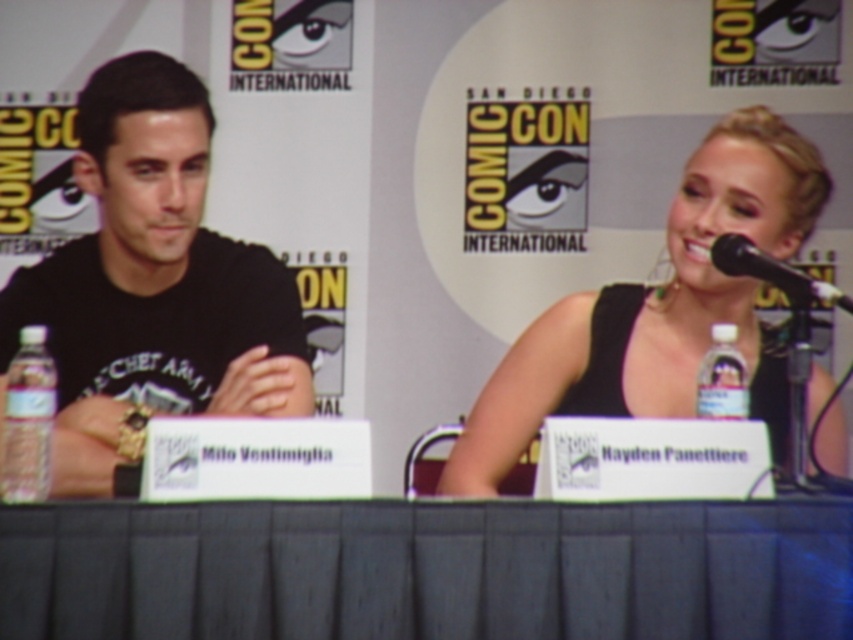
Is black fabric table at center wider than clear plastic bottle at center?

Correct, the width of black fabric table at center exceeds that of clear plastic bottle at center.

Does black fabric table at center appear on the right side of clear plastic bottle at center?

In fact, black fabric table at center is to the left of clear plastic bottle at center.

This screenshot has height=640, width=853. I want to click on black fabric table at center, so click(427, 570).

Find the location of `black fabric table at center`. black fabric table at center is located at coordinates (427, 570).

Is point (341, 611) farther from viewer compared to point (457, 451)?

No, it is in front of (457, 451).

Can you confirm if black fabric table at center is taller than black satin dress at upper right?

In fact, black fabric table at center may be shorter than black satin dress at upper right.

Find the location of `black fabric table at center`. black fabric table at center is located at coordinates (427, 570).

Is clear plastic bottle at left positioned behind black plastic microphone at upper right?

No.

From the picture: Can you confirm if clear plastic bottle at left is taller than black plastic microphone at upper right?

Yes.

At what (x,y) coordinates should I click in order to perform the action: click on clear plastic bottle at left. Please return your answer as a coordinate pair (x, y). This screenshot has height=640, width=853. Looking at the image, I should click on (28, 419).